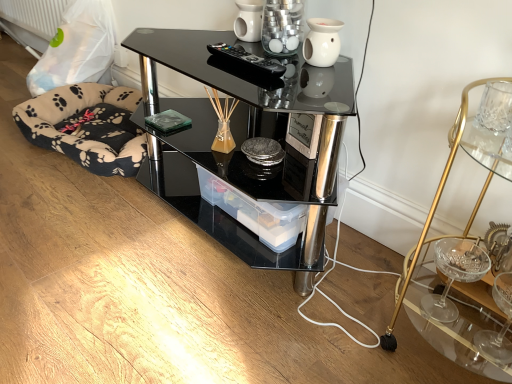
Question: Is black fleece dog bed at lower left in front of or behind black plastic remote at upper center in the image?

Choices:
 (A) front
 (B) behind

Answer: (B)

Question: In terms of width, does black fleece dog bed at lower left look wider or thinner when compared to black plastic remote at upper center?

Choices:
 (A) thin
 (B) wide

Answer: (B)

Question: Which of these objects is positioned closest to the black plastic remote at upper center?

Choices:
 (A) white ceramic candle holder at upper center
 (B) white ceramic vase at upper center
 (C) transparent plastic container at center
 (D) gold metallic cocktail table at right
 (E) black fleece dog bed at lower left

Answer: (A)

Question: Which object is the closest to the black fleece dog bed at lower left?

Choices:
 (A) transparent plastic container at center
 (B) white ceramic vase at upper center
 (C) black glass desk at center
 (D) white ceramic candle holder at upper center
 (E) black plastic remote at upper center

Answer: (C)